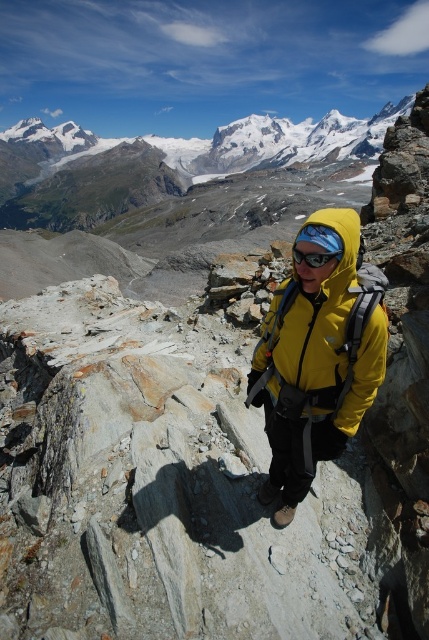
Does yellow matte jacket at center appear on the left side of transparent plastic goggles at center?

Incorrect, yellow matte jacket at center is not on the left side of transparent plastic goggles at center.

From the picture: Does yellow matte jacket at center have a larger size compared to transparent plastic goggles at center?

Yes, yellow matte jacket at center is bigger than transparent plastic goggles at center.

Does point (305, 252) come farther from viewer compared to point (332, 252)?

Yes, it is behind point (332, 252).

At what (x,y) coordinates should I click in order to perform the action: click on yellow matte jacket at center. Please return your answer as a coordinate pair (x, y). Image resolution: width=429 pixels, height=640 pixels. Looking at the image, I should click on (320, 308).